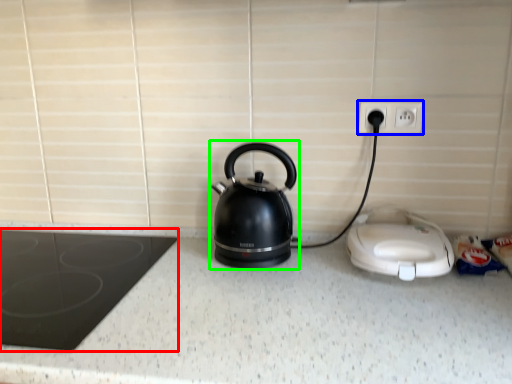
Question: Which is nearer to the home appliance (highlighted by a red box)? electric outlet (highlighted by a blue box) or kitchen appliance (highlighted by a green box).

Choices:
 (A) electric outlet
 (B) kitchen appliance

Answer: (B)